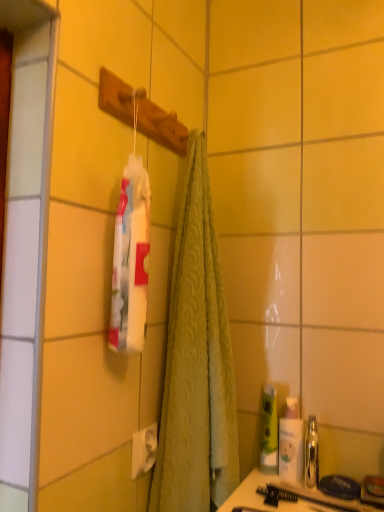
Question: From a real-world perspective, is translucent plastic bottle at right positioned over green matte bottle at lower right, the 1th mouthwash viewed from the left, based on gravity?

Choices:
 (A) yes
 (B) no

Answer: (B)

Question: Would you say translucent plastic bottle at right is a long distance from green matte bottle at lower right, the 1th mouthwash viewed from the left?

Choices:
 (A) yes
 (B) no

Answer: (B)

Question: Are translucent plastic bottle at right and green matte bottle at lower right, arranged as the second mouthwash when viewed from the right, beside each other?

Choices:
 (A) no
 (B) yes

Answer: (B)

Question: Does translucent plastic bottle at right have a lesser width compared to green matte bottle at lower right, the 1th mouthwash viewed from the left?

Choices:
 (A) no
 (B) yes

Answer: (A)

Question: Is translucent plastic bottle at right positioned behind green matte bottle at lower right, the 1th mouthwash viewed from the left?

Choices:
 (A) no
 (B) yes

Answer: (A)

Question: Is point (304, 480) closer or farther from the camera than point (261, 441)?

Choices:
 (A) farther
 (B) closer

Answer: (B)

Question: From their relative heights in the image, would you say shiny metallic mouthwash at right, acting as the first mouthwash starting from the right, is taller or shorter than green matte bottle at lower right, arranged as the second mouthwash when viewed from the right?

Choices:
 (A) short
 (B) tall

Answer: (A)

Question: Considering the positions of shiny metallic mouthwash at right, the 2th mouthwash in the left-to-right sequence, and green matte bottle at lower right, the 1th mouthwash viewed from the left, in the image, is shiny metallic mouthwash at right, the 2th mouthwash in the left-to-right sequence, wider or thinner than green matte bottle at lower right, the 1th mouthwash viewed from the left,?

Choices:
 (A) thin
 (B) wide

Answer: (B)

Question: Considering their positions, is shiny metallic mouthwash at right, the 2th mouthwash in the left-to-right sequence, located in front of or behind green matte bottle at lower right, the 1th mouthwash viewed from the left?

Choices:
 (A) front
 (B) behind

Answer: (A)

Question: Is point (269, 416) closer or farther from the camera than point (299, 433)?

Choices:
 (A) closer
 (B) farther

Answer: (B)

Question: From a real-world perspective, is green matte bottle at lower right, arranged as the second mouthwash when viewed from the right, physically located above or below translucent plastic bottle at right?

Choices:
 (A) above
 (B) below

Answer: (A)

Question: Considering their positions, is green matte bottle at lower right, the 1th mouthwash viewed from the left, located in front of or behind translucent plastic bottle at right?

Choices:
 (A) behind
 (B) front

Answer: (A)

Question: Is green matte bottle at lower right, the 1th mouthwash viewed from the left, bigger or smaller than translucent plastic bottle at right?

Choices:
 (A) big
 (B) small

Answer: (A)

Question: Would you say matte black comb at lower center is inside or outside translucent plastic bottle at right?

Choices:
 (A) inside
 (B) outside

Answer: (B)

Question: In terms of width, does matte black comb at lower center look wider or thinner when compared to translucent plastic bottle at right?

Choices:
 (A) wide
 (B) thin

Answer: (A)